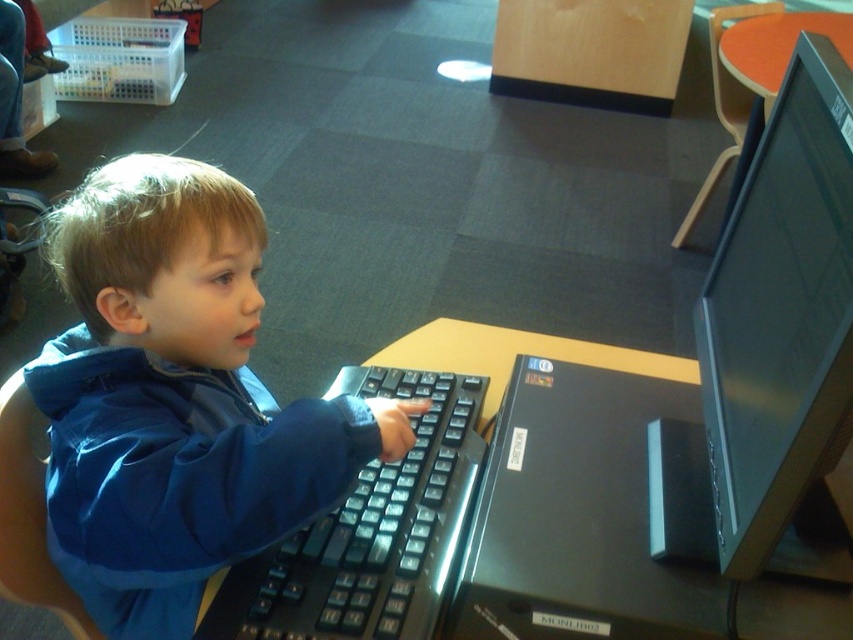
From the picture: You are a parent trying to set up a laptop on the desk. The laptop requires placing it between the black plastic keyboard at center and the monitor. Can you do this without moving the keyboard?

The black plastic keyboard at center is already positioned in front of the child, so placing the laptop between it and the monitor would require moving the keyboard to make space. Therefore, it is not possible to place the laptop without moving the keyboard.

You are a parent setting up a computer desk for your child. You have a black plastic keyboard at center and a brown wooden table at center. Where should you place the keyboard relative to the table to match the image?

The black plastic keyboard at center should be placed below the brown wooden table at center as shown in the image.

You are a photographer trying to capture a closeup of the child without moving any objects. The camera is currently positioned at the point marked by coordinates point (177, 400). Can you get a clear shot of the child?

The point (177, 400) marks the blue matte jacket at center, so positioning the camera there would allow a clear shot of the child since the jacket is at the center and the camera is aimed towards the child.